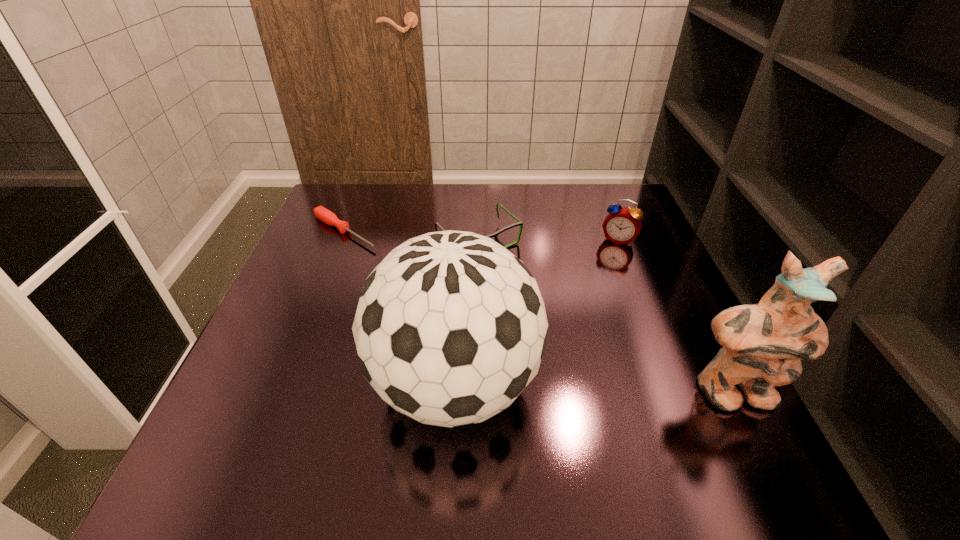
Locate an element on the screen. The image size is (960, 540). vacant space at the far right corner is located at coordinates pos(631,188).

Where is `free point between the fourth tallest object and the figurine`? The height and width of the screenshot is (540, 960). free point between the fourth tallest object and the figurine is located at coordinates (606, 318).

Locate an element on the screen. This screenshot has height=540, width=960. empty space that is in between the alarm clock and the figurine is located at coordinates coord(676,317).

The height and width of the screenshot is (540, 960). Identify the location of free space that is in between the third shortest object and the spectacles. (548, 241).

Identify the location of free point between the figurine and the second shortest object. The height and width of the screenshot is (540, 960). click(x=606, y=318).

The image size is (960, 540). Find the location of `free space between the figurine and the soccer ball`. free space between the figurine and the soccer ball is located at coordinates (594, 389).

Locate which object ranks second in proximity to the figurine. Please provide its 2D coordinates. Your answer should be formatted as a tuple, i.e. [(x, y)], where the tuple contains the x and y coordinates of a point satisfying the conditions above.

[(622, 225)]

Identify the location of object that is the second closest to the figurine. Image resolution: width=960 pixels, height=540 pixels. (622, 225).

Where is `vacant space that satisfies the following two spatial constraints: 1. on the back side of the third tallest object; 2. on the left side of the soccer ball`? This screenshot has width=960, height=540. vacant space that satisfies the following two spatial constraints: 1. on the back side of the third tallest object; 2. on the left side of the soccer ball is located at coordinates (463, 240).

Where is `free space that satisfies the following two spatial constraints: 1. on the front side of the leftmost object; 2. on the right side of the fourth tallest object`? free space that satisfies the following two spatial constraints: 1. on the front side of the leftmost object; 2. on the right side of the fourth tallest object is located at coordinates (340, 242).